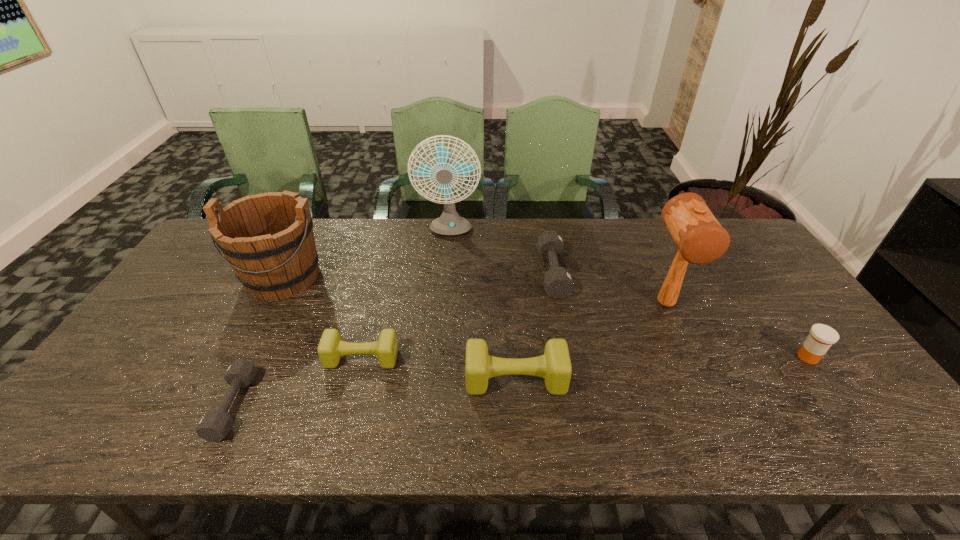
Identify the location of vacant space at the right edge of the desktop. (745, 301).

Identify the location of empty space that is in between the smaller olive dumbbell and the left gray dumbbell. Image resolution: width=960 pixels, height=540 pixels. (298, 382).

This screenshot has height=540, width=960. Identify the location of free point between the rightmost object and the farthest object. (628, 295).

Identify the location of free spot between the smaller gray dumbbell and the orange medicine. (520, 381).

At what (x,y) coordinates should I click in order to perform the action: click on vacant region between the sixth shortest object and the gray fan. Please return your answer as a coordinate pair (x, y). This screenshot has height=540, width=960. Looking at the image, I should click on (366, 254).

Where is `free space that is in between the wine bucket and the left olive dumbbell`? free space that is in between the wine bucket and the left olive dumbbell is located at coordinates (323, 317).

Where is `unoccupied area between the medicine and the nearer gray dumbbell`? This screenshot has width=960, height=540. unoccupied area between the medicine and the nearer gray dumbbell is located at coordinates (520, 381).

Identify the location of blank region between the bigger olive dumbbell and the second object from right to left. (590, 342).

This screenshot has height=540, width=960. What are the coordinates of `free space between the medicine and the mallet` in the screenshot? It's located at (736, 330).

This screenshot has height=540, width=960. I want to click on free spot between the sixth shortest object and the third dumbbell from right to left, so click(x=323, y=317).